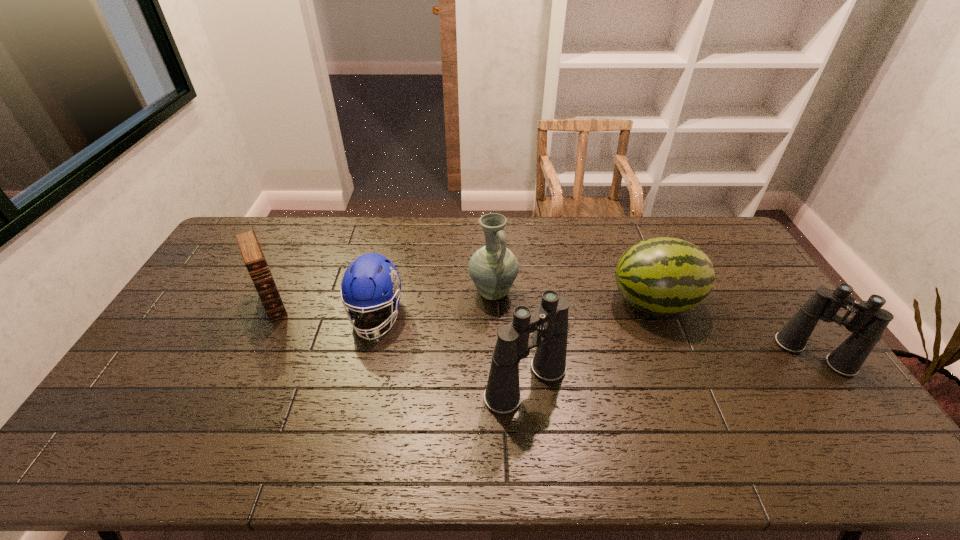
Where is `vacant region at the far left corner`? vacant region at the far left corner is located at coordinates (227, 251).

In order to click on free spot between the left binoculars and the second object from right to left in this screenshot , I will do `click(590, 343)`.

Image resolution: width=960 pixels, height=540 pixels. I want to click on vacant point located between the second object from left to right and the left binoculars, so click(x=451, y=349).

Locate an element on the screen. This screenshot has width=960, height=540. free spot between the rightmost object and the pitcher is located at coordinates (654, 323).

Locate an element on the screen. free space between the shorter binoculars and the taller binoculars is located at coordinates (670, 369).

The width and height of the screenshot is (960, 540). Find the location of `the second closest object to the leftmost object`. the second closest object to the leftmost object is located at coordinates click(x=493, y=268).

This screenshot has width=960, height=540. I want to click on object that stands as the fourth closest to the rightmost object, so click(x=364, y=281).

Where is `vacant space that satisfies the following two spatial constraints: 1. at the stem end of the shorter binoculars; 2. on the right side of the fifth object from left to right`? The image size is (960, 540). vacant space that satisfies the following two spatial constraints: 1. at the stem end of the shorter binoculars; 2. on the right side of the fifth object from left to right is located at coordinates (676, 355).

I want to click on vacant space that satisfies the following two spatial constraints: 1. on the face guard of the taller binoculars; 2. on the right side of the fifth object from right to left, so click(x=360, y=383).

Find the location of a particular element. This screenshot has width=960, height=540. vacant region that satisfies the following two spatial constraints: 1. at the stem end of the watermelon; 2. on the front side of the Bible is located at coordinates (655, 303).